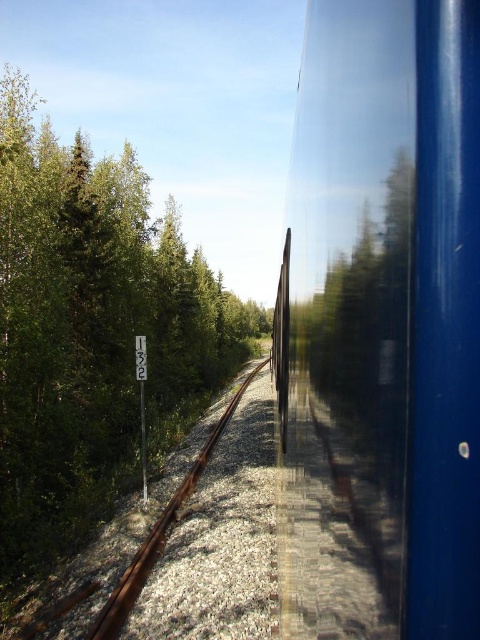
You are standing at the camera position inside the train and want to reach the point marked as point (x=36, y=486). Is this point within arm reach?

The distance between you and point (x=36, y=486) is 9.76 meters, which is too far to reach with your arm. You would need to move closer.

You are a passenger sitting inside the train and looking out the window. You notice the glossy blue train at right and the rusty metal train track at center. Which object is positioned to the right side of the other?

The glossy blue train at right is positioned to the right of the rusty metal train track at center.

You are a passenger on the train and want to take a photo of the rusty metal train track at center through the window. Can you see the glossy blue train at right in your photo?

The glossy blue train at right is closer to the viewer than the rusty metal train track at center, so it will block the view of the track in the photo.